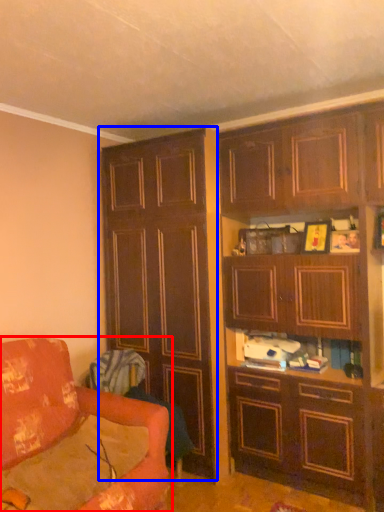
Question: Which object is further to the camera taking this photo, studio couch (highlighted by a red box) or cabinetry (highlighted by a blue box)?

Choices:
 (A) studio couch
 (B) cabinetry

Answer: (B)